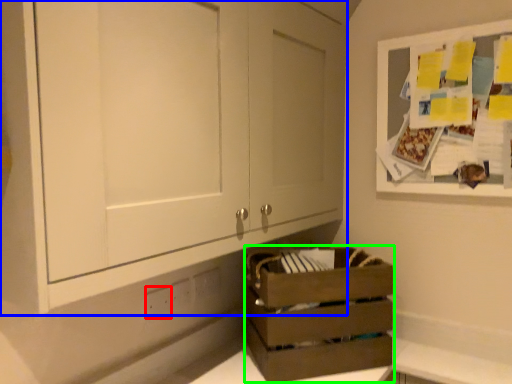
Question: Considering the real-world distances, which object is closest to electric outlet (highlighted by a red box)? cabinetry (highlighted by a blue box) or crate (highlighted by a green box).

Choices:
 (A) cabinetry
 (B) crate

Answer: (B)